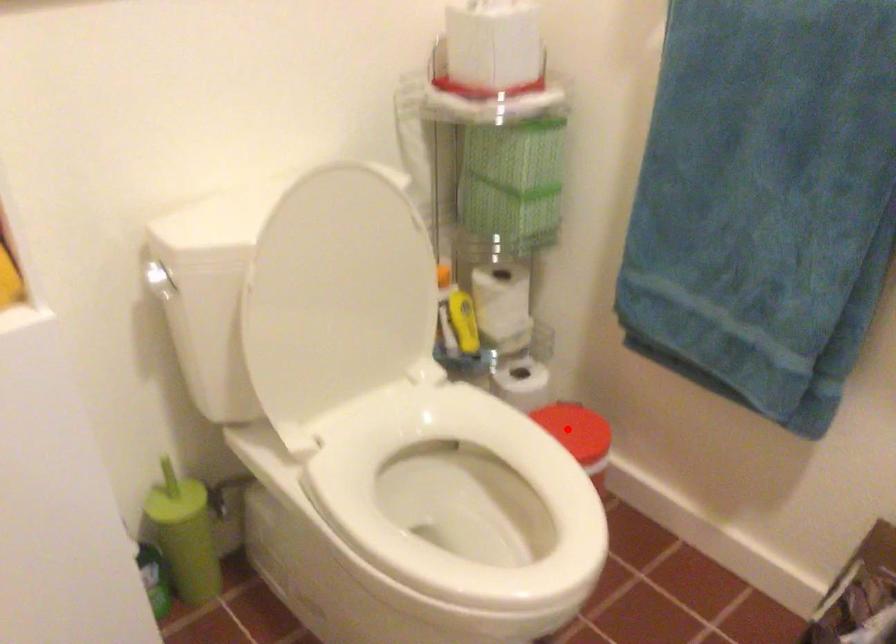
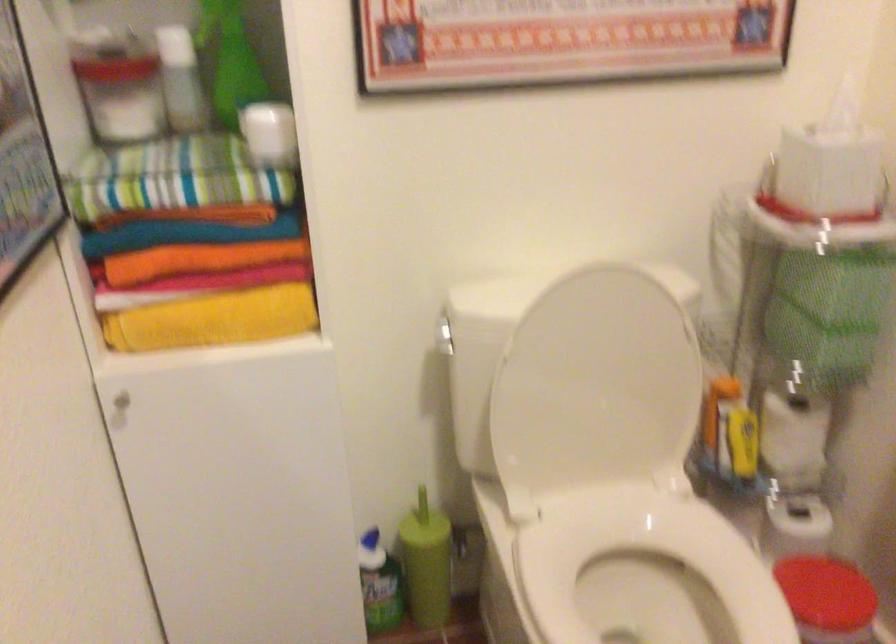
Where in the second image is the point corresponding to the highlighted location from the first image?

(824, 591)